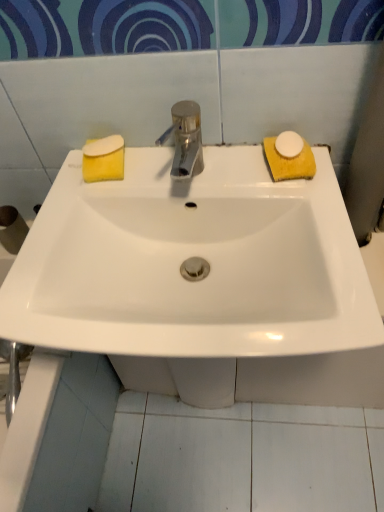
Question: Is white glossy sink at center taller or shorter than yellow sponge at left, the 1th soap in the left-to-right sequence?

Choices:
 (A) short
 (B) tall

Answer: (B)

Question: From a real-world perspective, is white glossy sink at center physically located above or below yellow sponge at left, the 3th soap in the right-to-left sequence?

Choices:
 (A) above
 (B) below

Answer: (B)

Question: Based on their relative distances, which object is nearer to the white matte soap at right, the 1th soap from the right?

Choices:
 (A) white matte soap at right, the 2th soap when ordered from right to left
 (B) polished metallic tap at center
 (C) yellow sponge at left, the 1th soap in the left-to-right sequence
 (D) white glossy sink at center

Answer: (A)

Question: Which object is positioned farthest from the polished metallic tap at center?

Choices:
 (A) white glossy sink at center
 (B) yellow sponge at left, the 3th soap in the right-to-left sequence
 (C) white matte soap at right, the 1th soap from the right
 (D) white matte soap at right, the 2th soap when ordered from right to left

Answer: (A)